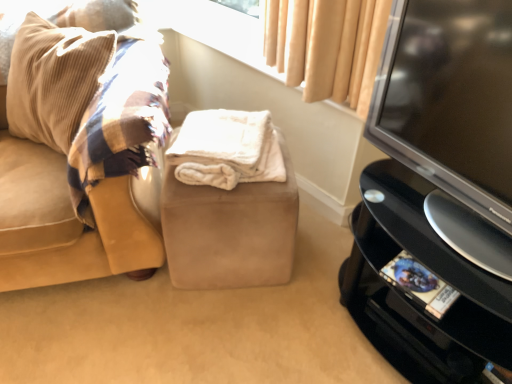
Question: Is beige fabric at upper center surrounding white fluffy blanket at center?

Choices:
 (A) yes
 (B) no

Answer: (B)

Question: Is the position of beige fabric at upper center less distant than that of white fluffy blanket at center?

Choices:
 (A) yes
 (B) no

Answer: (B)

Question: Does beige fabric at upper center have a smaller size compared to white fluffy blanket at center?

Choices:
 (A) yes
 (B) no

Answer: (B)

Question: From a real-world perspective, is beige fabric at upper center physically above white fluffy blanket at center?

Choices:
 (A) no
 (B) yes

Answer: (B)

Question: Can you confirm if beige fabric at upper center is thinner than white fluffy blanket at center?

Choices:
 (A) no
 (B) yes

Answer: (B)

Question: Is beige fabric at upper center to the left of white fluffy blanket at center from the viewer's perspective?

Choices:
 (A) yes
 (B) no

Answer: (B)

Question: Is beige fabric at upper center placed right next to suede couch at left?

Choices:
 (A) yes
 (B) no

Answer: (B)

Question: Is beige fabric at upper center positioned in front of suede couch at left?

Choices:
 (A) no
 (B) yes

Answer: (A)

Question: Can you confirm if beige fabric at upper center is wider than suede couch at left?

Choices:
 (A) yes
 (B) no

Answer: (B)

Question: Considering the relative positions of beige fabric at upper center and suede couch at left in the image provided, is beige fabric at upper center to the right of suede couch at left from the viewer's perspective?

Choices:
 (A) yes
 (B) no

Answer: (A)

Question: Is there a large distance between beige fabric at upper center and suede couch at left?

Choices:
 (A) no
 (B) yes

Answer: (A)

Question: From a real-world perspective, is beige fabric at upper center on top of suede couch at left?

Choices:
 (A) no
 (B) yes

Answer: (B)

Question: Considering the relative sizes of beige fabric at upper center and suede beige stool at center in the image provided, is beige fabric at upper center shorter than suede beige stool at center?

Choices:
 (A) no
 (B) yes

Answer: (B)